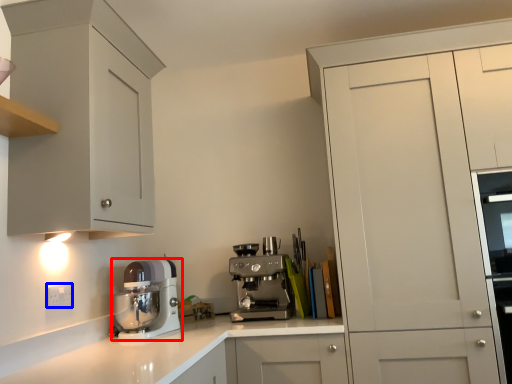
Question: Which point is further to the camera, kitchen appliance (highlighted by a red box) or electric outlet (highlighted by a blue box)?

Choices:
 (A) kitchen appliance
 (B) electric outlet

Answer: (A)